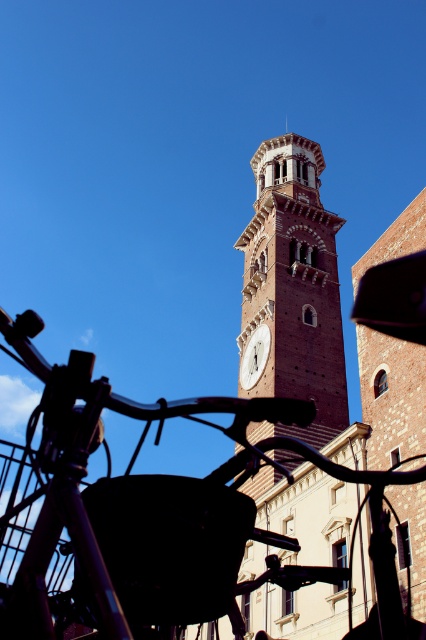
Is point (336, 292) closer to viewer compared to point (265, 355)?

No.

Is point (282, 147) farther from viewer compared to point (261, 353)?

Yes, point (282, 147) is farther from viewer.

Does point (334, 257) come farther from viewer compared to point (241, 376)?

Yes.

Identify the location of brown brick clock tower at center. (291, 291).

Is point (77, 563) positioned after point (267, 234)?

No, it is in front of (267, 234).

At what (x,y) coordinates should I click in order to perform the action: click on black matte bicycle at lower left. Please return your answer as a coordinate pair (x, y). This screenshot has width=426, height=640. Looking at the image, I should click on click(x=158, y=513).

You are a GUI agent. You are given a task and a screenshot of the screen. Output one action in this format:
    pyautogui.click(x=<x>, y=<y>)
    Task: Click on the black matte bicycle at lower left
    Image resolution: width=426 pixels, height=640 pixels.
    Given the screenshot: What is the action you would take?
    pyautogui.click(x=158, y=513)

Does point (83, 580) come closer to viewer compared to point (239, 376)?

Yes, it is in front of point (239, 376).

Which is below, black matte bicycle at lower left or white marble clock at center?

black matte bicycle at lower left is lower down.

Find the location of `black matte bicycle at lower left`. black matte bicycle at lower left is located at coordinates (158, 513).